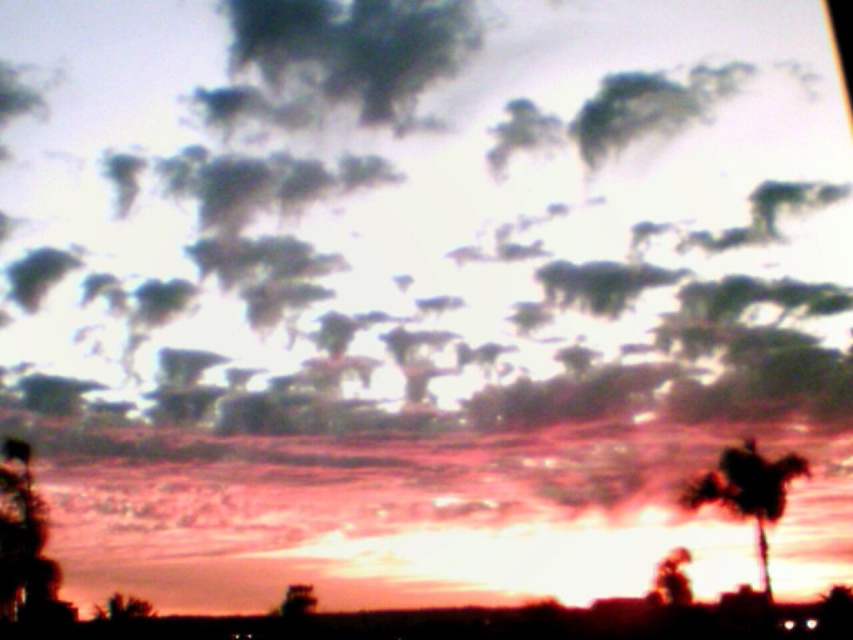
Does white fluffy cloud at upper center have a larger size compared to silhouette leafy palm at right?

Yes.

Is point (838, 410) positioned in front of point (764, 557)?

No, (838, 410) is behind (764, 557).

Locate an element on the screen. The width and height of the screenshot is (853, 640). white fluffy cloud at upper center is located at coordinates (422, 209).